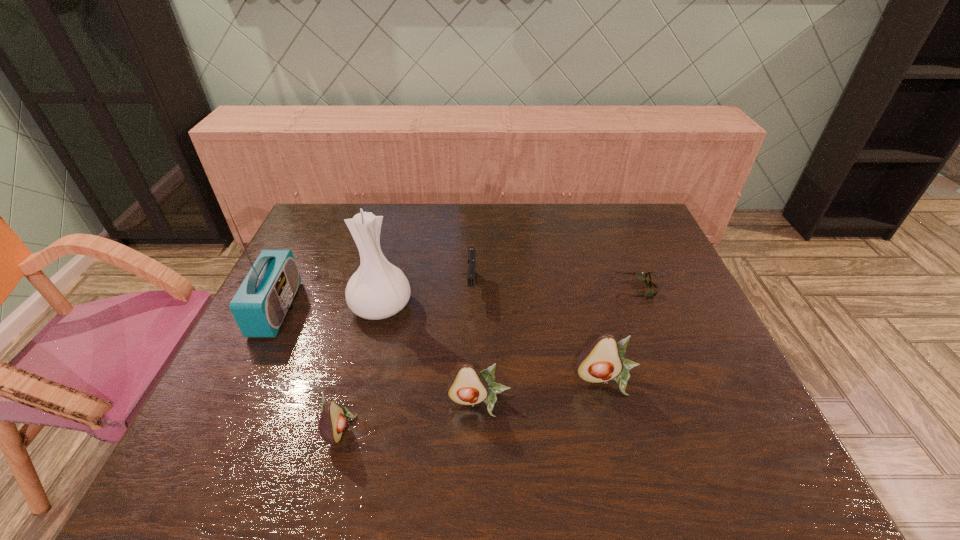
Image resolution: width=960 pixels, height=540 pixels. Find the location of `vacant region located on the seed side of the fifth tallest object`. vacant region located on the seed side of the fifth tallest object is located at coordinates (474, 427).

The image size is (960, 540). Identify the location of free space located on the seed side of the sixth object from left to right. (617, 420).

You are a GUI agent. You are given a task and a screenshot of the screen. Output one action in this format:
    pyautogui.click(x=<x>, y=<y>)
    Task: Click on the vacant area situated 0.390m on the back of the vase
    Image resolution: width=960 pixels, height=540 pixels.
    Given the screenshot: What is the action you would take?
    (x=403, y=214)

Where is `vacant space located 0.330m on the front panel of the radio receiver`? The height and width of the screenshot is (540, 960). vacant space located 0.330m on the front panel of the radio receiver is located at coordinates (412, 309).

Locate an element on the screen. vacant space located 0.250m aim along the barrel of the pistol is located at coordinates (470, 380).

Locate an element on the screen. vacant area located on the front-facing side of the shortest object is located at coordinates (527, 289).

Find the location of a particular element. This screenshot has height=540, width=960. vacant space located 0.230m on the front-facing side of the shortest object is located at coordinates (534, 289).

Find the location of a particular element. The width and height of the screenshot is (960, 540). vacant space located on the front-facing side of the shortest object is located at coordinates (575, 289).

Where is `object present at the left edge`? object present at the left edge is located at coordinates (261, 303).

Identify the location of object located in the right edge section of the desktop. The height and width of the screenshot is (540, 960). (645, 277).